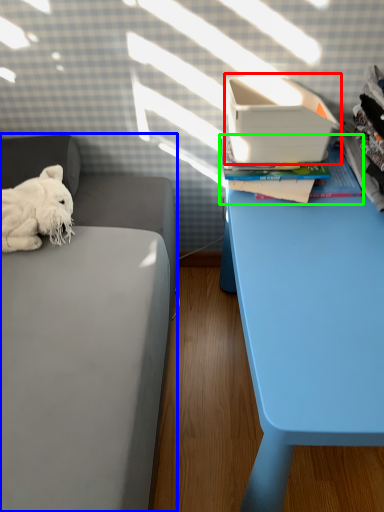
Question: Which is farther away from shoe box (highlighted by a red box)? furniture (highlighted by a blue box) or paperback book (highlighted by a green box)?

Choices:
 (A) furniture
 (B) paperback book

Answer: (A)